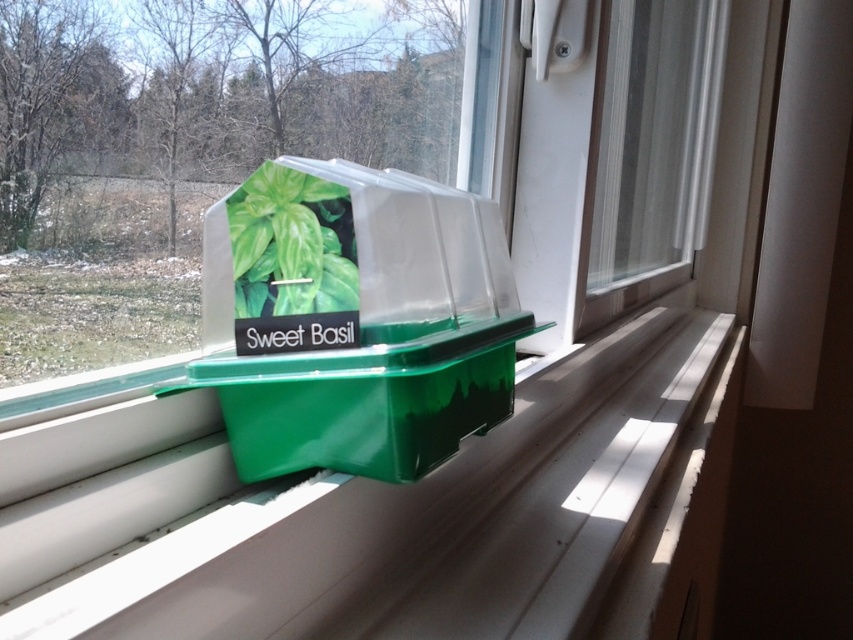
Question: Which object is the farthest from the green plastic container at center?

Choices:
 (A) green matte plastic sweet basil at center
 (B) green plastic box at center

Answer: (A)

Question: Which object is the closest to the green matte plastic sweet basil at center?

Choices:
 (A) green plastic box at center
 (B) green plastic container at center

Answer: (A)

Question: Is green plastic container at center further to camera compared to green matte plastic sweet basil at center?

Choices:
 (A) yes
 (B) no

Answer: (B)

Question: Considering the relative positions of green plastic container at center and green plastic box at center in the image provided, where is green plastic container at center located with respect to green plastic box at center?

Choices:
 (A) right
 (B) left

Answer: (A)

Question: Which object is closer to the camera taking this photo?

Choices:
 (A) green plastic container at center
 (B) green plastic box at center

Answer: (A)

Question: Does green plastic container at center come in front of green plastic box at center?

Choices:
 (A) no
 (B) yes

Answer: (B)